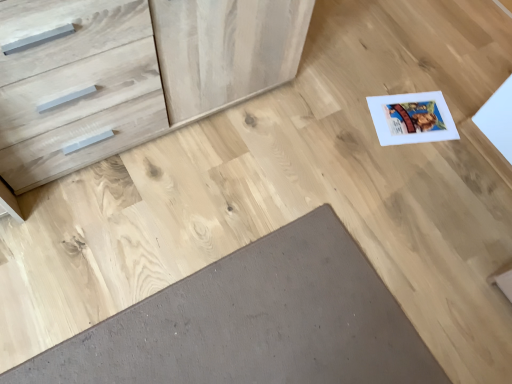
Question: Is brown matte doormat at lower center wider than natural wood chest of drawers at upper left?

Choices:
 (A) no
 (B) yes

Answer: (B)

Question: Considering the relative positions of brown matte doormat at lower center and natural wood chest of drawers at upper left in the image provided, is brown matte doormat at lower center to the left of natural wood chest of drawers at upper left from the viewer's perspective?

Choices:
 (A) yes
 (B) no

Answer: (B)

Question: Is brown matte doormat at lower center in contact with natural wood chest of drawers at upper left?

Choices:
 (A) no
 (B) yes

Answer: (A)

Question: Is brown matte doormat at lower center behind natural wood chest of drawers at upper left?

Choices:
 (A) no
 (B) yes

Answer: (B)

Question: Could you tell me if brown matte doormat at lower center is facing natural wood chest of drawers at upper left?

Choices:
 (A) yes
 (B) no

Answer: (B)

Question: Can you confirm if brown matte doormat at lower center is bigger than natural wood chest of drawers at upper left?

Choices:
 (A) no
 (B) yes

Answer: (A)

Question: Is natural wood chest of drawers at upper left facing towards brown matte doormat at lower center?

Choices:
 (A) yes
 (B) no

Answer: (A)

Question: Considering the relative sizes of natural wood chest of drawers at upper left and brown matte doormat at lower center in the image provided, is natural wood chest of drawers at upper left smaller than brown matte doormat at lower center?

Choices:
 (A) no
 (B) yes

Answer: (A)

Question: Considering the relative sizes of natural wood chest of drawers at upper left and brown matte doormat at lower center in the image provided, is natural wood chest of drawers at upper left shorter than brown matte doormat at lower center?

Choices:
 (A) yes
 (B) no

Answer: (B)

Question: Considering the relative sizes of natural wood chest of drawers at upper left and brown matte doormat at lower center in the image provided, is natural wood chest of drawers at upper left wider than brown matte doormat at lower center?

Choices:
 (A) yes
 (B) no

Answer: (B)

Question: Considering the relative sizes of natural wood chest of drawers at upper left and brown matte doormat at lower center in the image provided, is natural wood chest of drawers at upper left bigger than brown matte doormat at lower center?

Choices:
 (A) yes
 (B) no

Answer: (A)

Question: Is natural wood chest of drawers at upper left facing away from brown matte doormat at lower center?

Choices:
 (A) no
 (B) yes

Answer: (A)

Question: Visually, is brown matte doormat at lower center positioned to the left or to the right of natural wood chest of drawers at upper left?

Choices:
 (A) right
 (B) left

Answer: (A)